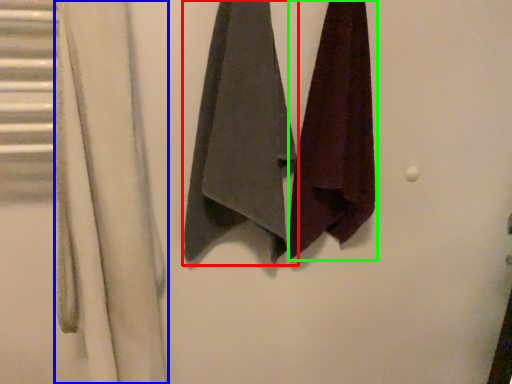
Question: Which is farther away from towel (highlighted by a red box)? curtain (highlighted by a blue box) or towel (highlighted by a green box)?

Choices:
 (A) curtain
 (B) towel

Answer: (A)